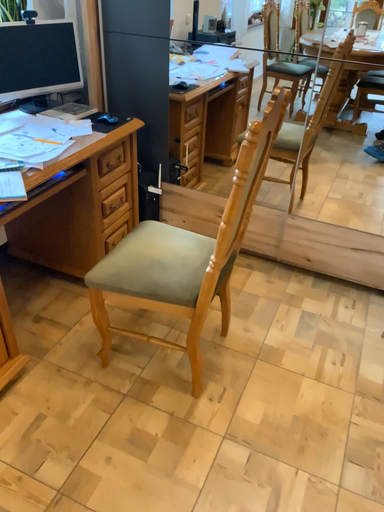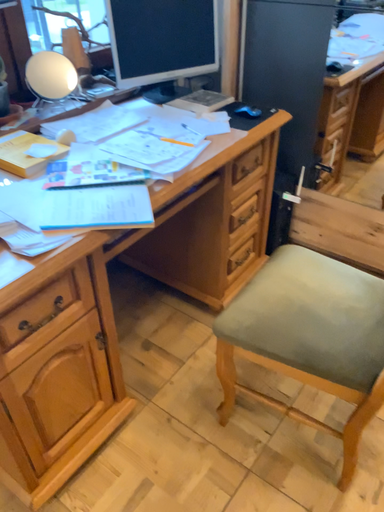
Question: How did the camera likely rotate when shooting the video?

Choices:
 (A) rotated right
 (B) rotated left

Answer: (B)